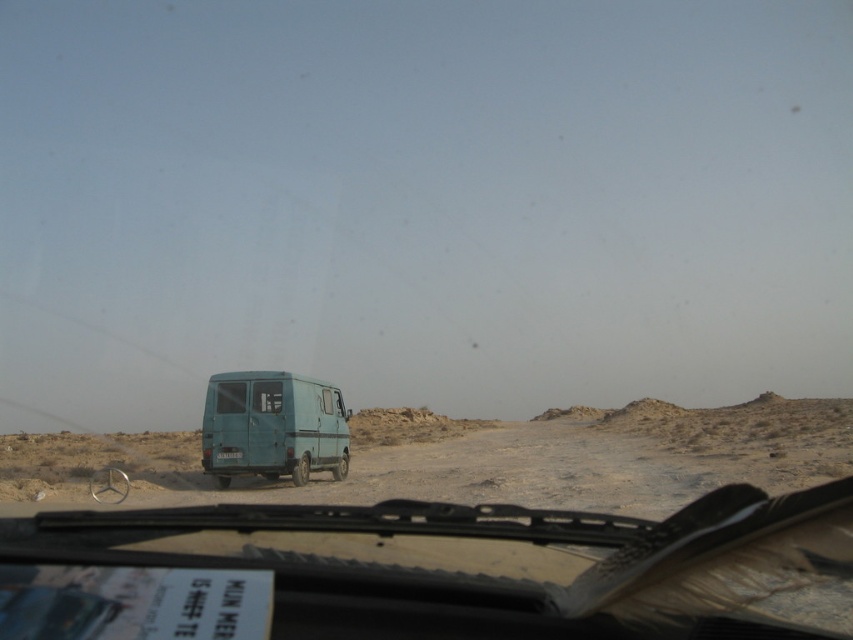
Is blue matte van at center taller than teal matte van at center?

Indeed, blue matte van at center has a greater height compared to teal matte van at center.

Measure the distance from blue matte van at center to teal matte van at center.

blue matte van at center is 27.63 meters from teal matte van at center.

Between point (383, 488) and point (212, 410), which one is positioned behind?

The point (383, 488) is more distant.

I want to click on blue matte van at center, so click(x=485, y=460).